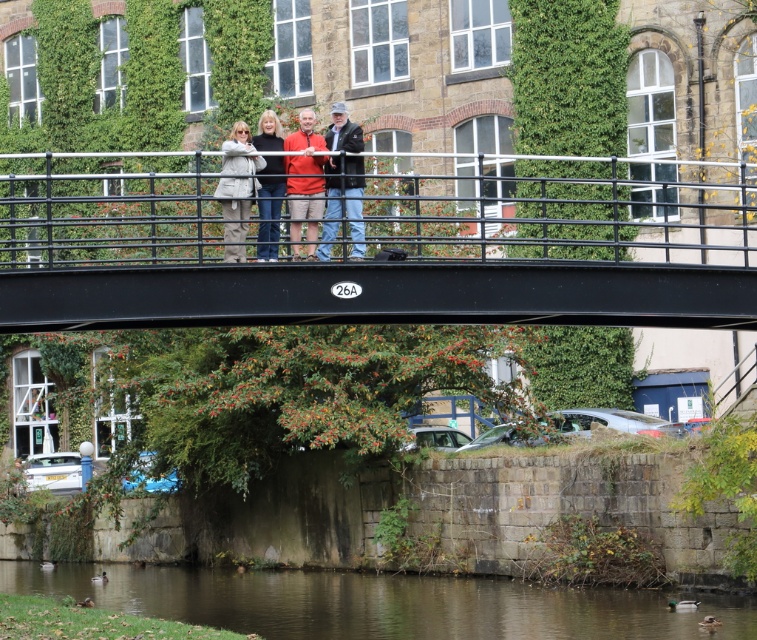
Between matte black jackets at center and matte black jacket at center, which one is positioned lower?

Positioned lower is matte black jackets at center.

Measure the distance between matte black jackets at center and camera.

28.20 meters

Is point (298, 216) positioned before point (282, 180)?

No, it is not.

This screenshot has height=640, width=757. Identify the location of matte black jackets at center. (304, 148).

Does matte black jackets at center have a smaller size compared to light gray fabric jacket at center?

Indeed, matte black jackets at center has a smaller size compared to light gray fabric jacket at center.

Who is lower down, matte black jackets at center or light gray fabric jacket at center?

matte black jackets at center is below.

What do you see at coordinates (304, 148) in the screenshot? I see `matte black jackets at center` at bounding box center [304, 148].

Image resolution: width=757 pixels, height=640 pixels. Find the location of `matte black jackets at center`. matte black jackets at center is located at coordinates (304, 148).

Between greenish-brown water at lower center and light gray fabric jacket at center, which one is positioned lower?

greenish-brown water at lower center is lower down.

Who is higher up, greenish-brown water at lower center or light gray fabric jacket at center?

light gray fabric jacket at center is higher up.

The image size is (757, 640). In order to click on greenish-brown water at lower center in this screenshot , I will do `click(382, 604)`.